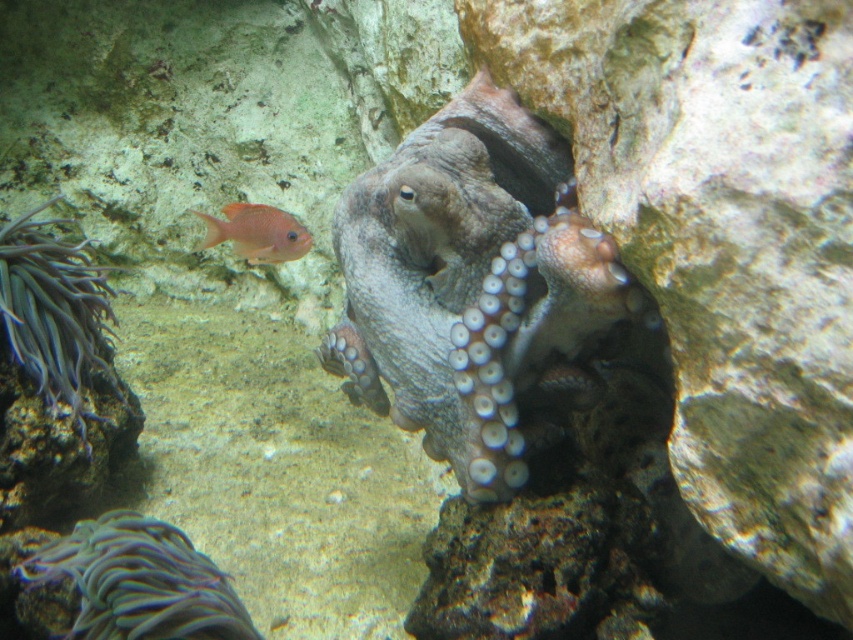
Is point (152, 556) less distant than point (235, 241)?

Yes, point (152, 556) is in front of point (235, 241).

Find the location of `grayish-blue soft coral at lower left`. grayish-blue soft coral at lower left is located at coordinates (138, 580).

Does gray matte octopus at center have a larger size compared to matte orange fish at left?

Indeed, gray matte octopus at center has a larger size compared to matte orange fish at left.

Is gray matte octopus at center smaller than matte orange fish at left?

Incorrect, gray matte octopus at center is not smaller in size than matte orange fish at left.

Is point (575, 266) positioned after point (271, 246)?

No, it is in front of (271, 246).

Identify the location of gray matte octopus at center. (471, 284).

Does gray soft anemone at left have a larger size compared to matte orange fish at left?

Yes.

Can you confirm if gray soft anemone at left is positioned to the right of matte orange fish at left?

In fact, gray soft anemone at left is to the left of matte orange fish at left.

Measure the distance between gray soft anemone at left and camera.

gray soft anemone at left is 4.28 feet away from camera.

In order to click on gray soft anemone at left in this screenshot , I will do `click(54, 310)`.